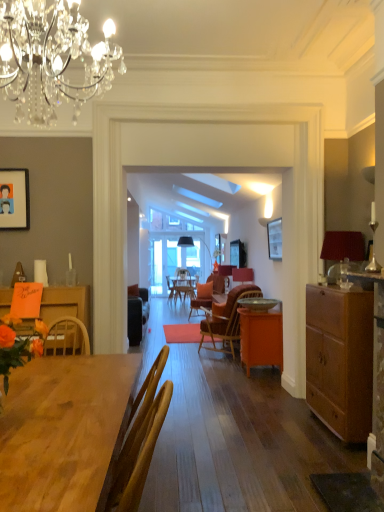
Question: Is orange matte cabinet at center smaller than wooden chair at center?

Choices:
 (A) yes
 (B) no

Answer: (A)

Question: From a real-world perspective, is orange matte cabinet at center physically below wooden chair at center?

Choices:
 (A) yes
 (B) no

Answer: (A)

Question: Does orange matte cabinet at center contain wooden chair at center?

Choices:
 (A) no
 (B) yes

Answer: (A)

Question: Does orange matte cabinet at center have a larger size compared to wooden chair at center?

Choices:
 (A) yes
 (B) no

Answer: (B)

Question: Is orange matte cabinet at center outside wooden chair at center?

Choices:
 (A) yes
 (B) no

Answer: (A)

Question: Considering their positions, is wooden chair at center located in front of or behind metallic gold bowl at center?

Choices:
 (A) behind
 (B) front

Answer: (A)

Question: Is wooden chair at center taller or shorter than metallic gold bowl at center?

Choices:
 (A) short
 (B) tall

Answer: (B)

Question: From the image's perspective, is wooden chair at center located above or below metallic gold bowl at center?

Choices:
 (A) below
 (B) above

Answer: (A)

Question: Based on their sizes in the image, would you say wooden chair at center is bigger or smaller than metallic gold bowl at center?

Choices:
 (A) small
 (B) big

Answer: (B)

Question: Considering the positions of wooden table at lower left and orange matte cabinet at center in the image, is wooden table at lower left bigger or smaller than orange matte cabinet at center?

Choices:
 (A) big
 (B) small

Answer: (B)

Question: From the image's perspective, is wooden table at lower left located above or below orange matte cabinet at center?

Choices:
 (A) below
 (B) above

Answer: (B)

Question: Is wooden table at lower left to the left or to the right of orange matte cabinet at center in the image?

Choices:
 (A) left
 (B) right

Answer: (A)

Question: In terms of width, does wooden table at lower left look wider or thinner when compared to orange matte cabinet at center?

Choices:
 (A) wide
 (B) thin

Answer: (A)

Question: Considering the positions of matte orange flowers at left and crystal chandelier at upper center, positioned as the 1th lamp in left-to-right order, in the image, is matte orange flowers at left wider or thinner than crystal chandelier at upper center, positioned as the 1th lamp in left-to-right order,?

Choices:
 (A) wide
 (B) thin

Answer: (B)

Question: Relative to crystal chandelier at upper center, the second lamp viewed from the back, is matte orange flowers at left in front or behind?

Choices:
 (A) front
 (B) behind

Answer: (B)